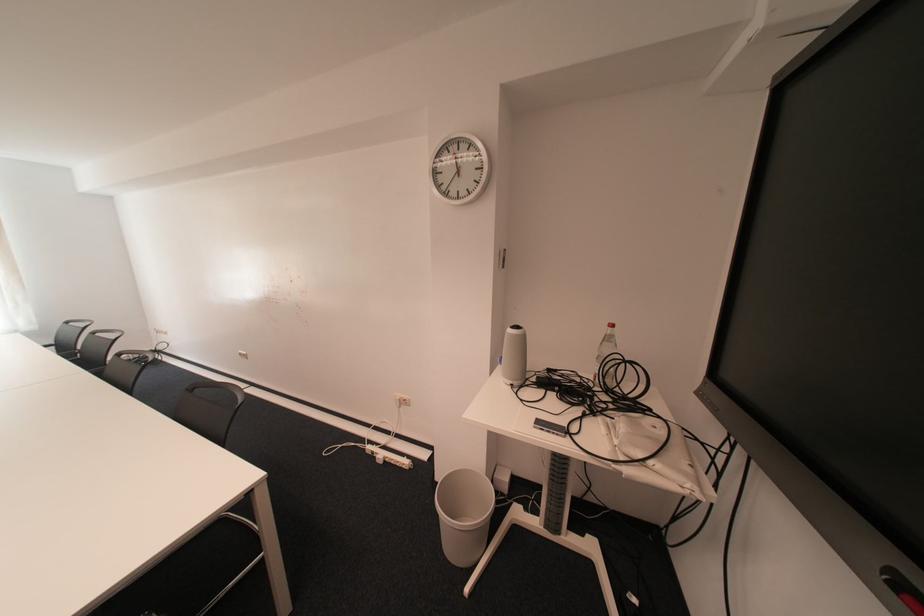
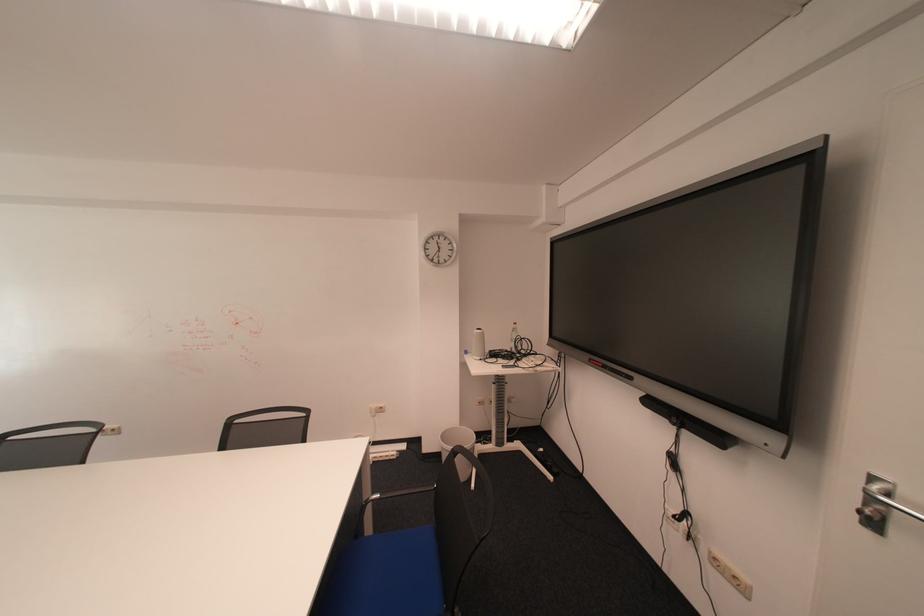
In the second image, find the point that corresponds to the point at 407,397 in the first image.

(382, 408)